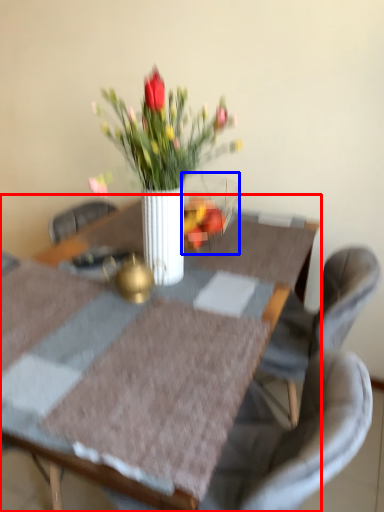
Question: Which point is closer to the camera, table (highlighted by a red box) or glass vase (highlighted by a blue box)?

Choices:
 (A) table
 (B) glass vase

Answer: (A)